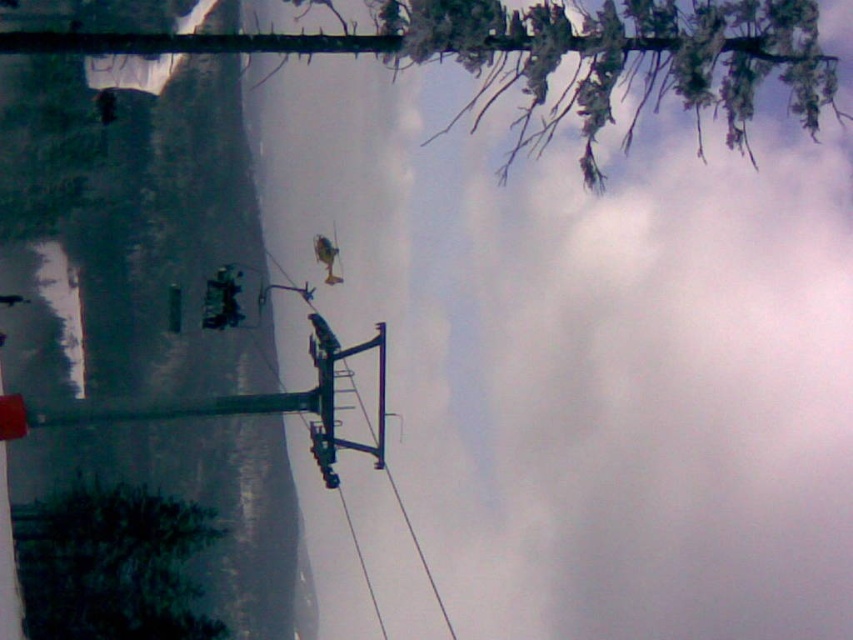
Question: Which object is farther from the camera taking this photo?

Choices:
 (A) green matte tree at lower left
 (B) smooth snow at left

Answer: (A)

Question: Can you confirm if snow-covered branches at upper center is smaller than green matte tree at lower left?

Choices:
 (A) no
 (B) yes

Answer: (B)

Question: Does green matte tree at lower left appear on the right side of black wire at upper center?

Choices:
 (A) no
 (B) yes

Answer: (A)

Question: Is smooth snow at left bigger than black wire at upper center?

Choices:
 (A) no
 (B) yes

Answer: (B)

Question: Which point is closer to the camera taking this photo?

Choices:
 (A) (171, 234)
 (B) (164, 625)

Answer: (B)

Question: Among these objects, which one is farthest from the camera?

Choices:
 (A) black wire at upper center
 (B) smooth snow at left
 (C) green matte tree at lower left
 (D) snow-covered branches at upper center

Answer: (C)